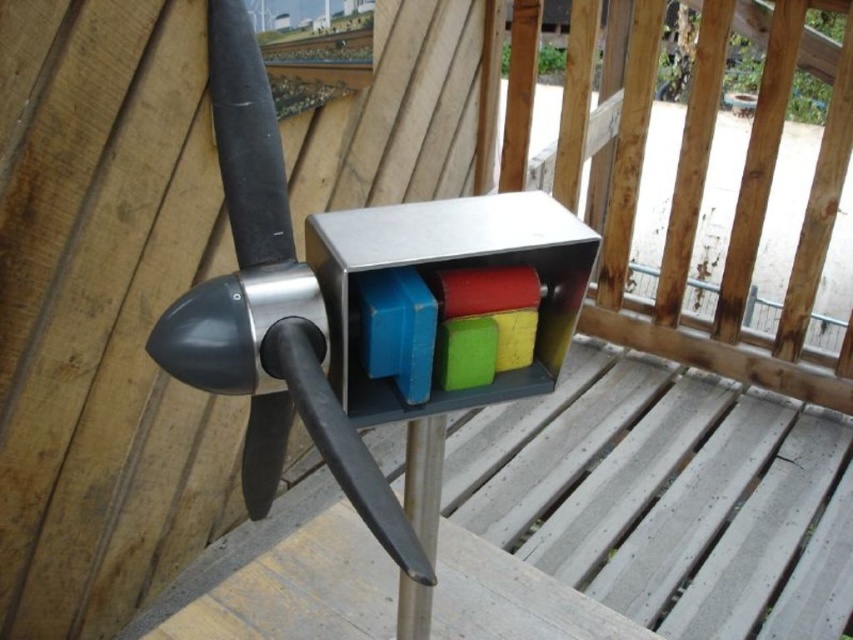
Question: Estimate the real-world distances between objects in this image. Which object is closer to the polished metal propeller at center?

Choices:
 (A) metallic gray propeller at center
 (B) silver metallic pole at center

Answer: (B)

Question: Does metallic gray propeller at center appear on the right side of silver metallic pole at center?

Choices:
 (A) no
 (B) yes

Answer: (B)

Question: Considering the relative positions of polished metal propeller at center and silver metallic pole at center in the image provided, where is polished metal propeller at center located with respect to silver metallic pole at center?

Choices:
 (A) right
 (B) left

Answer: (B)

Question: Does metallic gray propeller at center appear on the left side of silver metallic pole at center?

Choices:
 (A) yes
 (B) no

Answer: (B)

Question: Which object is closer to the camera taking this photo?

Choices:
 (A) polished metal propeller at center
 (B) metallic gray propeller at center

Answer: (A)

Question: Which point is farther to the camera?

Choices:
 (A) polished metal propeller at center
 (B) silver metallic pole at center

Answer: (B)